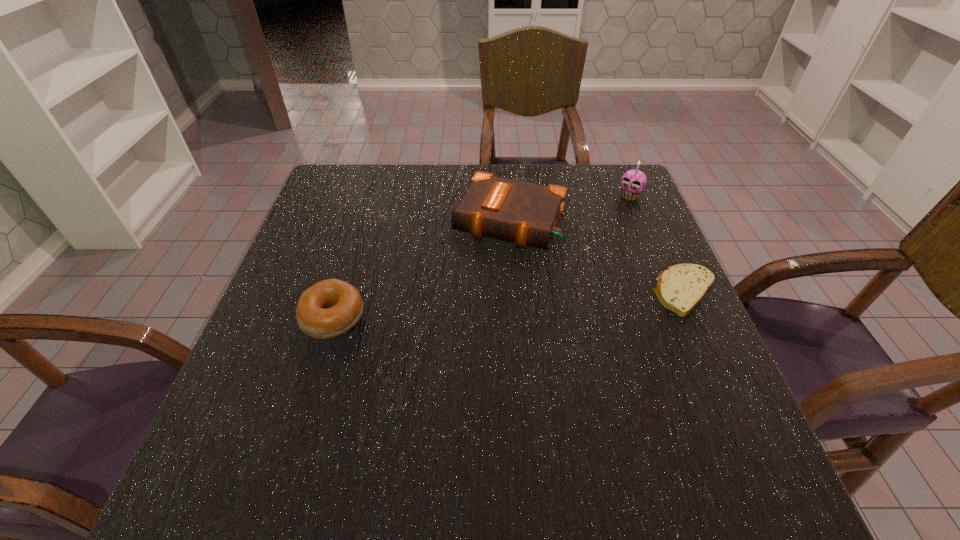
In order to click on the second shortest object in this screenshot , I will do `click(328, 309)`.

I want to click on bagel, so click(x=328, y=309).

This screenshot has height=540, width=960. In order to click on pita bread in this screenshot , I will do `click(680, 288)`.

At what (x,y) coordinates should I click in order to perform the action: click on the tallest object. Please return your answer as a coordinate pair (x, y). The image size is (960, 540). Looking at the image, I should click on (633, 182).

This screenshot has height=540, width=960. What are the coordinates of `the third object from right to left` in the screenshot? It's located at (525, 213).

What are the coordinates of `Bible` in the screenshot? It's located at (525, 213).

Locate an element on the screen. free space located 0.350m on the right of the bagel is located at coordinates (531, 318).

Where is `vacant point located on the front of the pita bread`? Image resolution: width=960 pixels, height=540 pixels. vacant point located on the front of the pita bread is located at coordinates (707, 339).

At what (x,y) coordinates should I click in order to perform the action: click on free spot located 0.390m on the face of the cupcake. Please return your answer as a coordinate pair (x, y). Looking at the image, I should click on (559, 286).

In order to click on free space located on the face of the cupcake in this screenshot , I will do click(x=557, y=288).